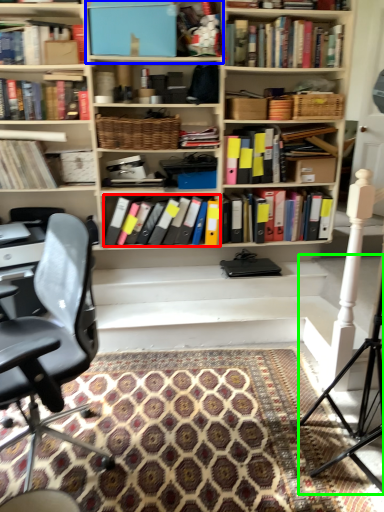
Question: Estimate the real-world distances between objects in this image. Which object is closer to book (highlighted by a red box), cabinet (highlighted by a blue box) or tripod (highlighted by a green box)?

Choices:
 (A) cabinet
 (B) tripod

Answer: (A)